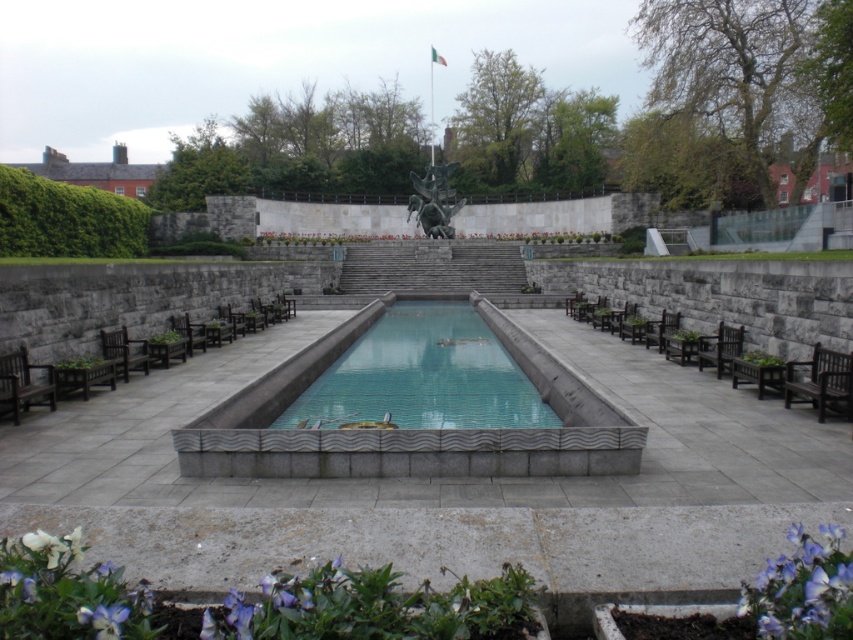
You are sitting on the brown wooden chair at right and want to move to the brown wooden bench at right. Which direction should you move to reach the bench?

The brown wooden bench at right is positioned on the right side of the brown wooden chair at right, so you should move to your right to reach the bench.

You are a visitor standing at the entrance of the memorial garden. You want to take a photo of the bronze statue at center and the dark brown wooden bench at lower left together in the frame. Which object should you position closer to the camera to ensure both are visible in the photo?

Since the bronze statue at center is taller than the dark brown wooden bench at lower left, you should position the bronze statue at center closer to the camera to ensure both objects are visible in the photo.

Based on the photo, you are planning to place a new decorative item between the bronze statue at center and the dark brown wooden bench at lower left. Considering their sizes, which object should you place closer to the smaller one to maintain balance?

Since the bronze statue at center is wider than the dark brown wooden bench at lower left, you should place the decorative item closer to the dark brown wooden bench at lower left to balance the composition.